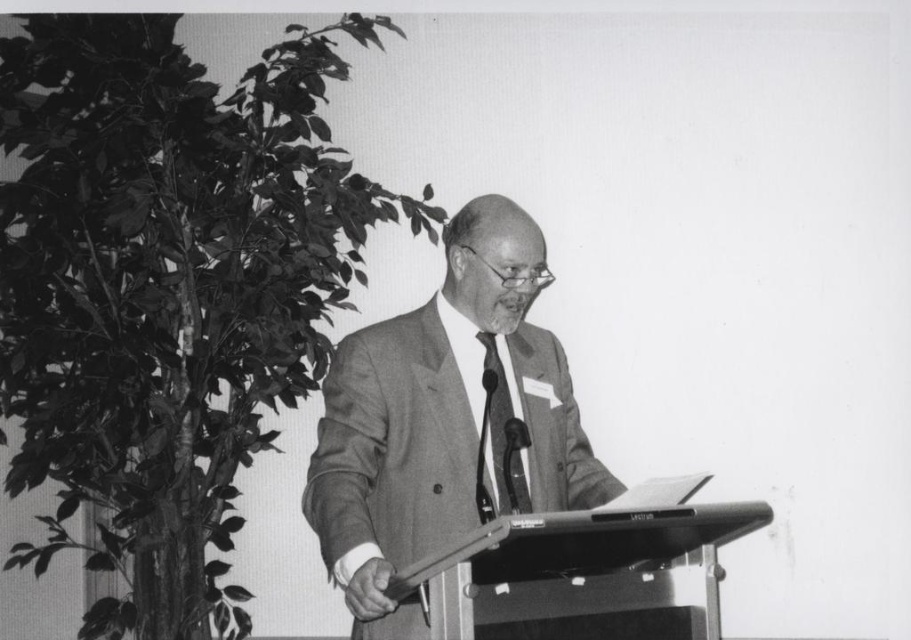
Does smooth gray suit at center appear over metallic/reflective microphone at center?

Actually, smooth gray suit at center is below metallic/reflective microphone at center.

Can you confirm if smooth gray suit at center is positioned to the left of metallic/reflective microphone at center?

Yes, smooth gray suit at center is to the left of metallic/reflective microphone at center.

Describe the element at coordinates (444, 419) in the screenshot. This screenshot has width=911, height=640. I see `smooth gray suit at center` at that location.

At what (x,y) coordinates should I click in order to perform the action: click on smooth gray suit at center. Please return your answer as a coordinate pair (x, y). Looking at the image, I should click on (444, 419).

Does metallic gray podium at center have a lesser height compared to matte black tie at center?

Indeed, metallic gray podium at center has a lesser height compared to matte black tie at center.

Does point (711, 513) come in front of point (504, 422)?

That is True.

Image resolution: width=911 pixels, height=640 pixels. I want to click on metallic gray podium at center, so click(x=570, y=554).

Who is lower down, metallic gray podium at center or metallic/reflective microphone at center?

metallic gray podium at center

Which is in front, point (454, 609) or point (480, 465)?

Point (454, 609)

Is point (479, 579) in front of point (484, 522)?

Yes.

In order to click on metallic gray podium at center in this screenshot , I will do pyautogui.click(x=570, y=554).